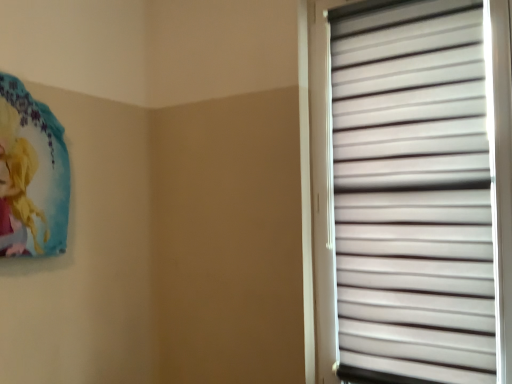
Based on the photo, measure the distance between point (432,325) and camera.

A distance of 1.55 meters exists between point (432,325) and camera.

Where is `white matte window blind at right`? The height and width of the screenshot is (384, 512). white matte window blind at right is located at coordinates (412, 193).

The height and width of the screenshot is (384, 512). What do you see at coordinates (412, 193) in the screenshot?
I see `white matte window blind at right` at bounding box center [412, 193].

What is the approximate width of white matte window blind at right?

white matte window blind at right is 3.54 inches in width.

Image resolution: width=512 pixels, height=384 pixels. I want to click on matte blue poster at upper left, so click(x=31, y=175).

The height and width of the screenshot is (384, 512). Describe the element at coordinates (31, 175) in the screenshot. I see `matte blue poster at upper left` at that location.

Identify the location of white matte window blind at right. The width and height of the screenshot is (512, 384). (412, 193).

Based on their positions, is matte blue poster at upper left located to the left or right of white matte window blind at right?

matte blue poster at upper left is to the left of white matte window blind at right.

Considering the positions of objects matte blue poster at upper left and white matte window blind at right in the image provided, who is in front, matte blue poster at upper left or white matte window blind at right?

white matte window blind at right is closer to the camera.

Is point (66, 164) positioned before point (376, 339)?

No, (66, 164) is further to viewer.

From the image's perspective, between matte blue poster at upper left and white matte window blind at right, which one is located above?

matte blue poster at upper left appears higher in the image.

From a real-world perspective, is matte blue poster at upper left above or below white matte window blind at right?

matte blue poster at upper left is above white matte window blind at right.

Can you confirm if matte blue poster at upper left is wider than white matte window blind at right?

Yes.

Which of these two, matte blue poster at upper left or white matte window blind at right, stands taller?

white matte window blind at right is taller.

Between matte blue poster at upper left and white matte window blind at right, which one has smaller size?

matte blue poster at upper left.

Consider the image. Do you think matte blue poster at upper left is within white matte window blind at right, or outside of it?

matte blue poster at upper left exists outside the volume of white matte window blind at right.

Are matte blue poster at upper left and white matte window blind at right far apart?

matte blue poster at upper left is far away from white matte window blind at right.

Is matte blue poster at upper left looking in the opposite direction of white matte window blind at right?

No.

This screenshot has height=384, width=512. In order to click on art above the white matte window blind at right (from the image's perspective) in this screenshot , I will do `click(31, 175)`.

Which is more to the right, white matte window blind at right or matte blue poster at upper left?

white matte window blind at right is more to the right.

Between white matte window blind at right and matte blue poster at upper left, which one is positioned behind?

matte blue poster at upper left is more distant.

Between point (406, 54) and point (7, 161), which one is positioned behind?

The point (406, 54) is more distant.

From the image's perspective, would you say white matte window blind at right is shown under matte blue poster at upper left?

Indeed, from the image's perspective, white matte window blind at right is shown beneath matte blue poster at upper left.

From a real-world perspective, is white matte window blind at right located higher than matte blue poster at upper left?

No, from a real-world perspective, white matte window blind at right is not above matte blue poster at upper left.

Which object is wider, white matte window blind at right or matte blue poster at upper left?

With larger width is matte blue poster at upper left.

Is white matte window blind at right taller or shorter than matte blue poster at upper left?

Considering their sizes, white matte window blind at right has more height than matte blue poster at upper left.

Who is bigger, white matte window blind at right or matte blue poster at upper left?

white matte window blind at right is bigger.

Is white matte window blind at right situated inside matte blue poster at upper left or outside?

white matte window blind at right is spatially situated outside matte blue poster at upper left.

Is white matte window blind at right far from matte blue poster at upper left?

Indeed, white matte window blind at right is not near matte blue poster at upper left.

Is white matte window blind at right facing away from matte blue poster at upper left?

No, white matte window blind at right is not facing the opposite direction of matte blue poster at upper left.

Can you tell me how much white matte window blind at right and matte blue poster at upper left differ in facing direction?

There is a 90-degree angle between the facing directions of white matte window blind at right and matte blue poster at upper left.

You are a GUI agent. You are given a task and a screenshot of the screen. Output one action in this format:
    pyautogui.click(x=<x>, y=<y>)
    Task: Click on the art located above the white matte window blind at right (from a real-world perspective)
    
    Given the screenshot: What is the action you would take?
    pyautogui.click(x=31, y=175)

At what (x,y) coordinates should I click in order to perform the action: click on window blind below the matte blue poster at upper left (from the image's perspective). Please return your answer as a coordinate pair (x, y). The image size is (512, 384). Looking at the image, I should click on (412, 193).

This screenshot has width=512, height=384. Identify the location of art above the white matte window blind at right (from a real-world perspective). (31, 175).